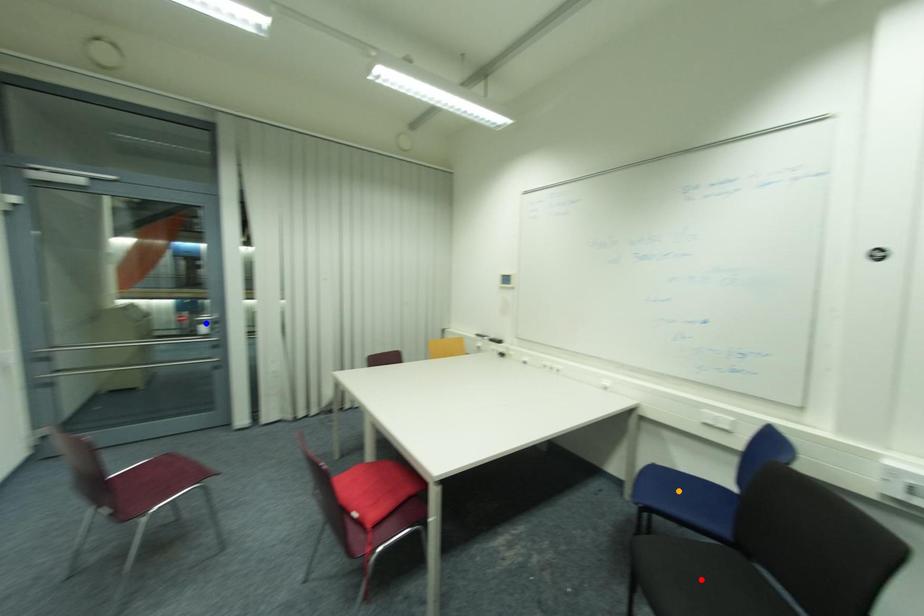
Order these from nearest to farthest:
orange point | red point | blue point

1. blue point
2. orange point
3. red point